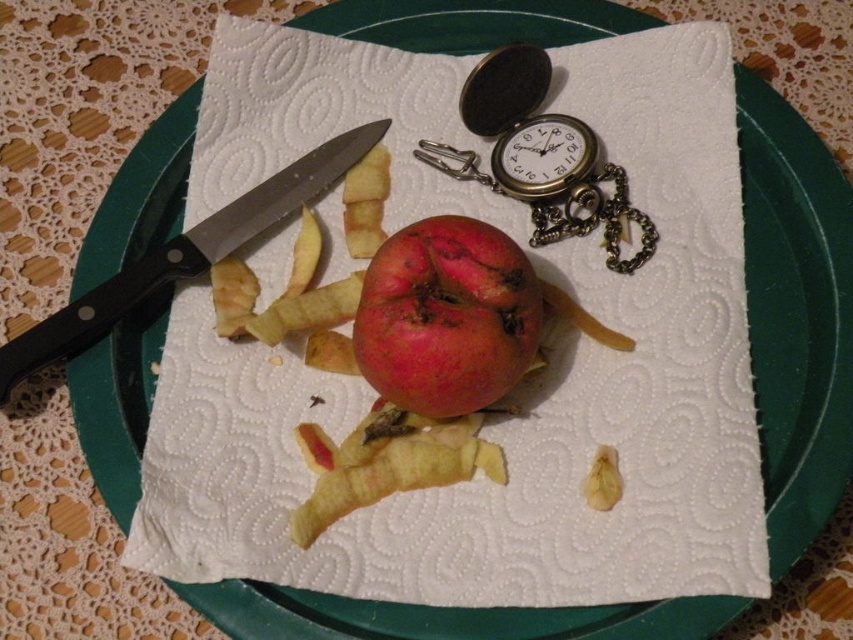
Question: Is rotten red apple at center below black plastic knife at upper left?

Choices:
 (A) no
 (B) yes

Answer: (B)

Question: Is rotten red apple at center positioned before black plastic knife at upper left?

Choices:
 (A) yes
 (B) no

Answer: (A)

Question: Which point appears closest to the camera in this image?

Choices:
 (A) (462, 106)
 (B) (422, 298)

Answer: (B)

Question: Among these points, which one is farthest from the camera?

Choices:
 (A) (521, 77)
 (B) (91, 312)
 (C) (397, 332)

Answer: (A)

Question: Observing the image, what is the correct spatial positioning of rotten red apple at center in reference to antique brass pocket watch at upper center?

Choices:
 (A) above
 (B) below

Answer: (B)

Question: Which object is the closest to the rotten red apple at center?

Choices:
 (A) antique brass pocket watch at upper center
 (B) black plastic knife at upper left

Answer: (A)